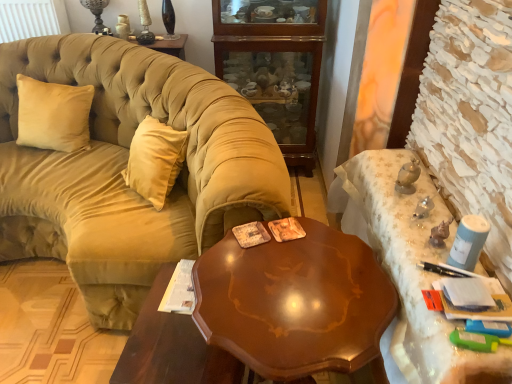
In order to face shiny brown wood table at center, which ranks as the 1th desk in left-to-right order, should I rotate leftwards or rightwards?

To align with it, rotate right about 3.996°.

Describe the element at coordinates (266, 313) in the screenshot. Image resolution: width=512 pixels, height=384 pixels. I see `shiny brown wood table at center, which appears as the 2th desk when viewed from the right` at that location.

What is the approximate height of glossy wood table at center?

glossy wood table at center is 46.60 centimeters in height.

This screenshot has height=384, width=512. I want to click on velvet beige couch at left, so click(125, 167).

I want to click on beige velvet pillow at left, so click(53, 115).

Is white lace tablecloth at right, which ranks as the 2th desk in left-to-right order, oriented away from glossy wood table at center?

No, glossy wood table at center is not at the back of white lace tablecloth at right, which ranks as the 2th desk in left-to-right order.

Does white lace tablecloth at right, which is the 1th desk from right to left, have a lesser width compared to glossy wood table at center?

Yes.

How different are the orientations of white lace tablecloth at right, which ranks as the 2th desk in left-to-right order, and glossy wood table at center in degrees?

2.57 degrees.

Is white lace tablecloth at right, which ranks as the 2th desk in left-to-right order, next to glossy wood table at center?

No, white lace tablecloth at right, which ranks as the 2th desk in left-to-right order, is not making contact with glossy wood table at center.

Is glossy wood table at center wider or thinner than white lace tablecloth at right, which ranks as the 2th desk in left-to-right order?

Considering their sizes, glossy wood table at center looks broader than white lace tablecloth at right, which ranks as the 2th desk in left-to-right order.

Does glossy wood table at center come in front of white lace tablecloth at right, which ranks as the 2th desk in left-to-right order?

No, glossy wood table at center is behind white lace tablecloth at right, which ranks as the 2th desk in left-to-right order.

Is glossy wood table at center not close to white lace tablecloth at right, which ranks as the 2th desk in left-to-right order?

Actually, glossy wood table at center and white lace tablecloth at right, which ranks as the 2th desk in left-to-right order, are a little close together.

Is shiny brown wood table at center, which appears as the 2th desk when viewed from the right, completely or partially inside beige velvet pillow at left?

No, shiny brown wood table at center, which appears as the 2th desk when viewed from the right, is located outside of beige velvet pillow at left.

Considering the sizes of objects beige velvet pillow at left and shiny brown wood table at center, which appears as the 2th desk when viewed from the right, in the image provided, who is smaller, beige velvet pillow at left or shiny brown wood table at center, which appears as the 2th desk when viewed from the right,?

Smaller between the two is beige velvet pillow at left.

Is point (23, 118) more distant than point (158, 337)?

Yes.

Is beige velvet pillow at left positioned before shiny brown wood table at center, which ranks as the 1th desk in left-to-right order?

No, beige velvet pillow at left is further to the viewer.

Does shiny brown wood table at center, which ranks as the 1th desk in left-to-right order, have a lesser height compared to glossy wood table at center?

In fact, shiny brown wood table at center, which ranks as the 1th desk in left-to-right order, may be taller than glossy wood table at center.

Would you say shiny brown wood table at center, which appears as the 2th desk when viewed from the right, is outside glossy wood table at center?

Yes, shiny brown wood table at center, which appears as the 2th desk when viewed from the right, is outside of glossy wood table at center.

Locate an element on the screen. This screenshot has height=384, width=512. table that appears behind the shiny brown wood table at center, which ranks as the 1th desk in left-to-right order is located at coordinates (170, 348).

Considering the relative positions of shiny brown wood table at center, which appears as the 2th desk when viewed from the right, and glossy wood table at center in the image provided, is shiny brown wood table at center, which appears as the 2th desk when viewed from the right, behind glossy wood table at center?

No, it is not.

Looking at this image, does glossy wood table at center have a lesser height compared to wooden cabinet at center?

Indeed, glossy wood table at center has a lesser height compared to wooden cabinet at center.

Is glossy wood table at center at the left side of wooden cabinet at center?

Yes.

Considering the sizes of objects glossy wood table at center and wooden cabinet at center in the image provided, who is wider, glossy wood table at center or wooden cabinet at center?

With larger width is wooden cabinet at center.

From the image's perspective, is glossy wood table at center above or below wooden cabinet at center?

From the image's perspective, glossy wood table at center appears below wooden cabinet at center.

From the image's perspective, which is above, velvet beige couch at left or white lace tablecloth at right, which is the 1th desk from right to left?

velvet beige couch at left appears higher in the image.

Can you confirm if velvet beige couch at left is bigger than white lace tablecloth at right, which ranks as the 2th desk in left-to-right order?

Indeed, velvet beige couch at left has a larger size compared to white lace tablecloth at right, which ranks as the 2th desk in left-to-right order.

What's the angular difference between velvet beige couch at left and white lace tablecloth at right, which ranks as the 2th desk in left-to-right order,'s facing directions?

The angle between the facing direction of velvet beige couch at left and the facing direction of white lace tablecloth at right, which ranks as the 2th desk in left-to-right order, is 88.7 degrees.

Considering the relative sizes of velvet beige couch at left and white lace tablecloth at right, which is the 1th desk from right to left, in the image provided, is velvet beige couch at left shorter than white lace tablecloth at right, which is the 1th desk from right to left,?

No.

From the image's perspective, is beige velvet pillow at left on glossy wood table at center?

Yes, from the image's perspective, beige velvet pillow at left is above glossy wood table at center.

Identify the location of table located below the beige velvet pillow at left (from the image's perspective). This screenshot has height=384, width=512. (170, 348).

Which object is more forward, beige velvet pillow at left or glossy wood table at center?

glossy wood table at center is more forward.

This screenshot has height=384, width=512. Find the location of `table located below the white lace tablecloth at right, which is the 1th desk from right to left (from the image's perspective)`. table located below the white lace tablecloth at right, which is the 1th desk from right to left (from the image's perspective) is located at coordinates (170, 348).

Where is `table below the white lace tablecloth at right, which ranks as the 2th desk in left-to-right order (from a real-world perspective)`? This screenshot has height=384, width=512. table below the white lace tablecloth at right, which ranks as the 2th desk in left-to-right order (from a real-world perspective) is located at coordinates (170, 348).

From the image, which object appears to be farther from white lace tablecloth at right, which ranks as the 2th desk in left-to-right order, beige velvet pillow at left or glossy wood table at center?

beige velvet pillow at left is further to white lace tablecloth at right, which ranks as the 2th desk in left-to-right order.

Looking at the image, which one is located further to shiny brown wood table at center, which ranks as the 1th desk in left-to-right order, white lace tablecloth at right, which is the 1th desk from right to left, or wooden cabinet at center?

Among the two, wooden cabinet at center is located further to shiny brown wood table at center, which ranks as the 1th desk in left-to-right order.

Considering their positions, is white lace tablecloth at right, which ranks as the 2th desk in left-to-right order, positioned further to wooden cabinet at center than glossy wood table at center?

Based on the image, glossy wood table at center appears to be further to wooden cabinet at center.

Based on the photo, estimate the real-world distances between objects in this image. Which object is further from glossy wood table at center, wooden cabinet at center or velvet beige couch at left?

wooden cabinet at center.

Estimate the real-world distances between objects in this image. Which object is further from white lace tablecloth at right, which is the 1th desk from right to left, velvet beige couch at left or beige velvet pillow at left?

Based on the image, beige velvet pillow at left appears to be further to white lace tablecloth at right, which is the 1th desk from right to left.

Which object lies further to the anchor point white lace tablecloth at right, which is the 1th desk from right to left, glossy wood table at center or velvet beige couch at left?

Based on the image, velvet beige couch at left appears to be further to white lace tablecloth at right, which is the 1th desk from right to left.

Looking at the image, which one is located closer to velvet beige couch at left, wooden cabinet at center or beige velvet pillow at left?

beige velvet pillow at left lies closer to velvet beige couch at left than the other object.

Estimate the real-world distances between objects in this image. Which object is further from white lace tablecloth at right, which ranks as the 2th desk in left-to-right order, glossy wood table at center or wooden cabinet at center?

wooden cabinet at center is further to white lace tablecloth at right, which ranks as the 2th desk in left-to-right order.

Where is `desk positioned between white lace tablecloth at right, which is the 1th desk from right to left, and wooden cabinet at center from near to far`? This screenshot has height=384, width=512. desk positioned between white lace tablecloth at right, which is the 1th desk from right to left, and wooden cabinet at center from near to far is located at coordinates (266, 313).

Identify the location of studio couch between white lace tablecloth at right, which ranks as the 2th desk in left-to-right order, and wooden cabinet at center, along the z-axis. (125, 167).

Find the location of `desk between velvet beige couch at left and white lace tablecloth at right, which ranks as the 2th desk in left-to-right order`. desk between velvet beige couch at left and white lace tablecloth at right, which ranks as the 2th desk in left-to-right order is located at coordinates (x=266, y=313).

Image resolution: width=512 pixels, height=384 pixels. I want to click on desk between glossy wood table at center and white lace tablecloth at right, which ranks as the 2th desk in left-to-right order, so click(x=266, y=313).